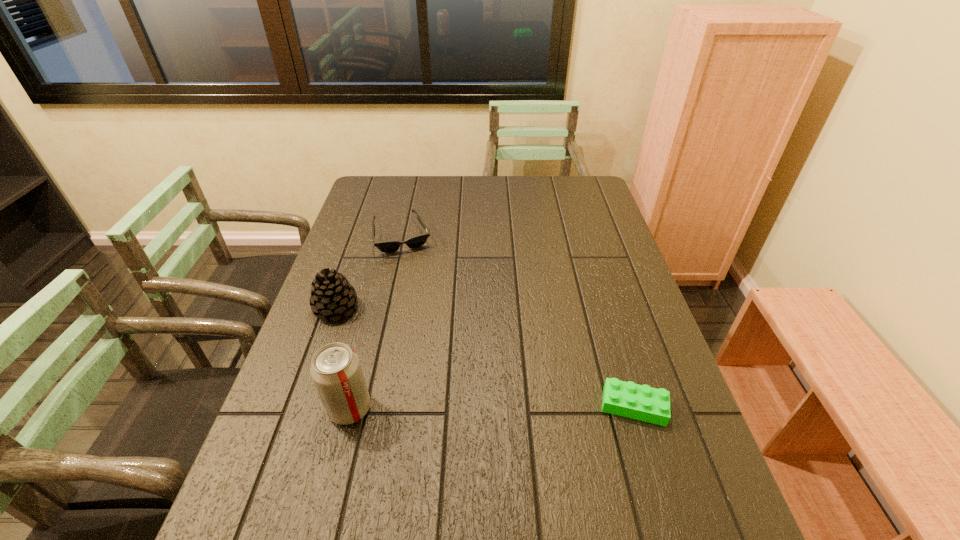
At what (x,y) coordinates should I click in order to perform the action: click on object that is the second nearest to the second farthest object. Please return your answer as a coordinate pair (x, y). Looking at the image, I should click on (336, 371).

I want to click on object that can be found as the third closest to the sunglasses, so click(x=641, y=402).

Find the location of a particular element. This screenshot has height=540, width=960. vacant area in the image that satisfies the following two spatial constraints: 1. on the back side of the Lego; 2. on the right side of the soda can is located at coordinates (350, 406).

At what (x,y) coordinates should I click in order to perform the action: click on blank area in the image that satisfies the following two spatial constraints: 1. on the front side of the pinecone; 2. on the right side of the rightmost object. Please return your answer as a coordinate pair (x, y). Looking at the image, I should click on (302, 406).

Where is `free location that satisfies the following two spatial constraints: 1. on the front side of the tallest object; 2. on the right side of the second farthest object`? The width and height of the screenshot is (960, 540). free location that satisfies the following two spatial constraints: 1. on the front side of the tallest object; 2. on the right side of the second farthest object is located at coordinates (301, 408).

At what (x,y) coordinates should I click in order to perform the action: click on free spot that satisfies the following two spatial constraints: 1. on the front side of the farthest object; 2. on the right side of the Lego. Please return your answer as a coordinate pair (x, y). Looking at the image, I should click on (364, 406).

Locate an element on the screen. This screenshot has width=960, height=540. free space that satisfies the following two spatial constraints: 1. on the front side of the third shortest object; 2. on the left side of the rightmost object is located at coordinates (302, 406).